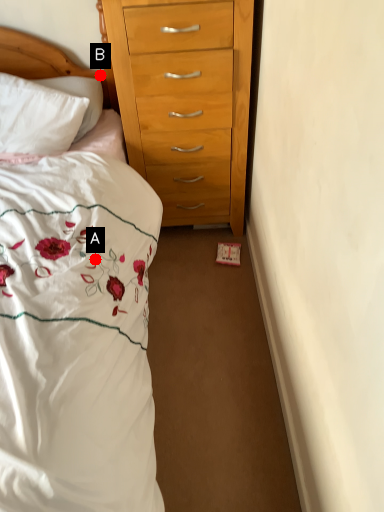
Question: Two points are circled on the image, labeled by A and B beside each circle. Which of the following is the farthest from the observer?

Choices:
 (A) A is further
 (B) B is further

Answer: (B)